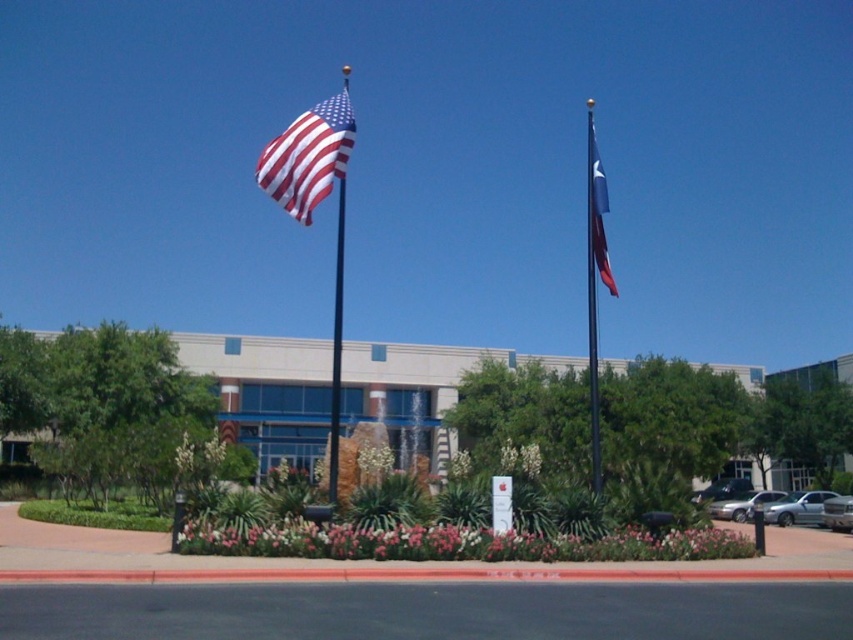
Is metallic flag pole at center wider than blue fabric flag at upper right?

Correct, the width of metallic flag pole at center exceeds that of blue fabric flag at upper right.

Does point (593, 211) come closer to viewer compared to point (602, 192)?

Yes, point (593, 211) is in front of point (602, 192).

Identify the location of metallic flag pole at center. The image size is (853, 640). (595, 282).

From the picture: Who is positioned more to the left, matte fabric flag at upper center or silver metallic sedan at lower right?

matte fabric flag at upper center

Who is more distant from viewer, (323, 150) or (799, 522)?

The point (799, 522) is behind.

Locate an element on the screen. This screenshot has height=640, width=853. matte fabric flag at upper center is located at coordinates (308, 156).

Does point (335, 394) come in front of point (779, 516)?

Yes, point (335, 394) is closer to viewer.

Which is more to the right, blue metallic flag pole at upper left or silver metallic sedan at lower right?

From the viewer's perspective, silver metallic sedan at lower right appears more on the right side.

The image size is (853, 640). What do you see at coordinates (335, 346) in the screenshot?
I see `blue metallic flag pole at upper left` at bounding box center [335, 346].

Find the location of a particular element. This screenshot has height=640, width=853. blue metallic flag pole at upper left is located at coordinates (335, 346).